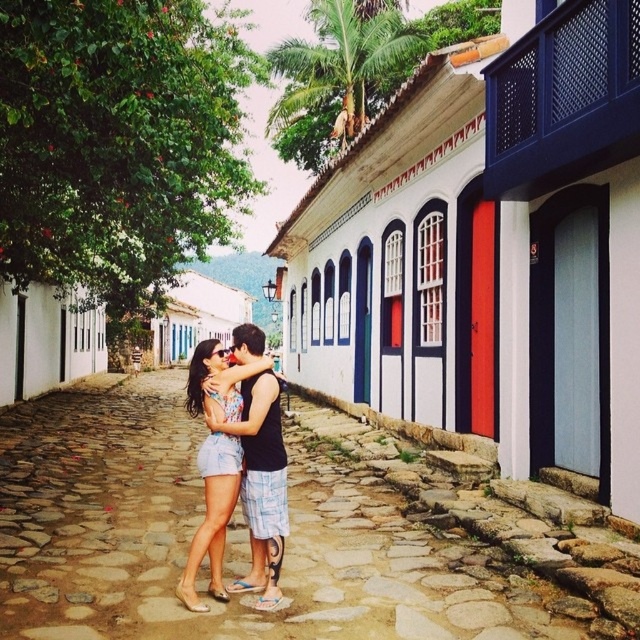
You are standing at the point labeled as point (289, 538) in the image. Looking around, you see a smooth stone alley at center. Based on the scene description, what is the immediate environment around your current position?

The point (289, 538) corresponds to the smooth stone alley at center, so your immediate environment is the smooth stone alley at center.